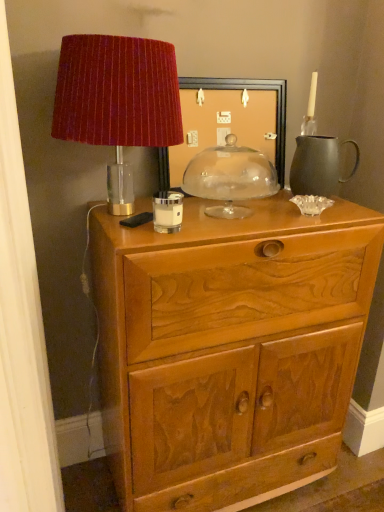
Question: From a real-world perspective, is matte black picture frame at center below wooden carved chest of drawers at center?

Choices:
 (A) yes
 (B) no

Answer: (B)

Question: Is matte black picture frame at center positioned before wooden carved chest of drawers at center?

Choices:
 (A) yes
 (B) no

Answer: (B)

Question: From the image's perspective, is matte black picture frame at center over wooden carved chest of drawers at center?

Choices:
 (A) yes
 (B) no

Answer: (A)

Question: Is the position of matte black picture frame at center more distant than that of wooden carved chest of drawers at center?

Choices:
 (A) yes
 (B) no

Answer: (A)

Question: Is matte black picture frame at center shorter than wooden carved chest of drawers at center?

Choices:
 (A) yes
 (B) no

Answer: (A)

Question: Can you confirm if matte black picture frame at center is taller than wooden carved chest of drawers at center?

Choices:
 (A) no
 (B) yes

Answer: (A)

Question: Is matte black pitcher at right behind velvet red lampshade at upper left?

Choices:
 (A) no
 (B) yes

Answer: (B)

Question: Is matte black pitcher at right wider than velvet red lampshade at upper left?

Choices:
 (A) yes
 (B) no

Answer: (B)

Question: Does matte black pitcher at right have a lesser height compared to velvet red lampshade at upper left?

Choices:
 (A) no
 (B) yes

Answer: (B)

Question: Considering the relative positions of matte black pitcher at right and velvet red lampshade at upper left in the image provided, is matte black pitcher at right in front of velvet red lampshade at upper left?

Choices:
 (A) no
 (B) yes

Answer: (A)

Question: Could you tell me if matte black pitcher at right is facing velvet red lampshade at upper left?

Choices:
 (A) no
 (B) yes

Answer: (A)

Question: Considering the relative sizes of matte black pitcher at right and velvet red lampshade at upper left in the image provided, is matte black pitcher at right taller than velvet red lampshade at upper left?

Choices:
 (A) no
 (B) yes

Answer: (A)

Question: Does wooden carved chest of drawers at center lie in front of velvet red lampshade at upper left?

Choices:
 (A) yes
 (B) no

Answer: (B)